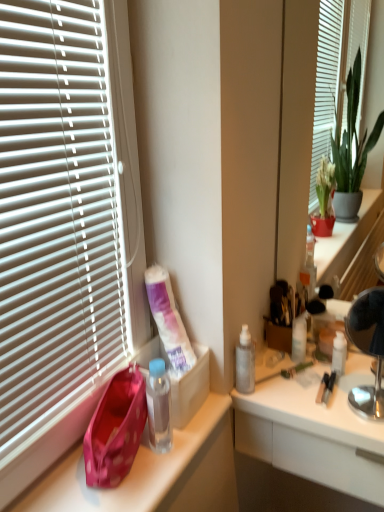
Find the location of a particular element. vacant area that is in front of translucent plastic bottle at upper right is located at coordinates (317, 395).